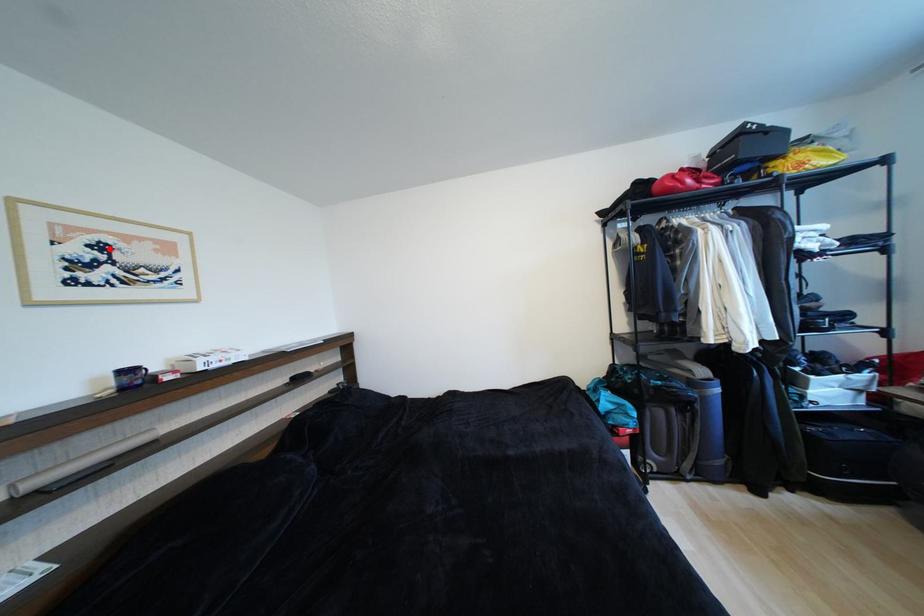
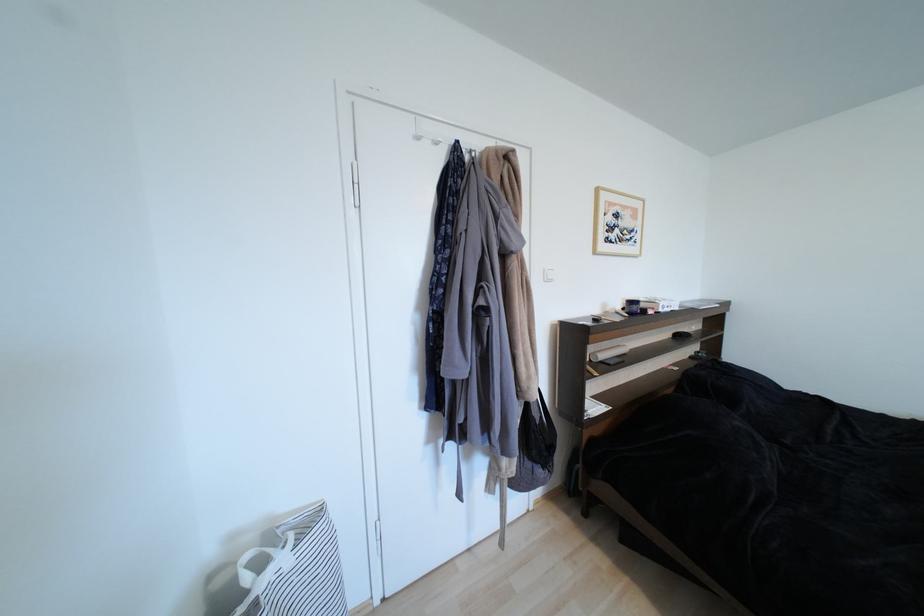
The point at the highlighted location is marked in the first image. Where is the corresponding point in the second image?

(623, 217)